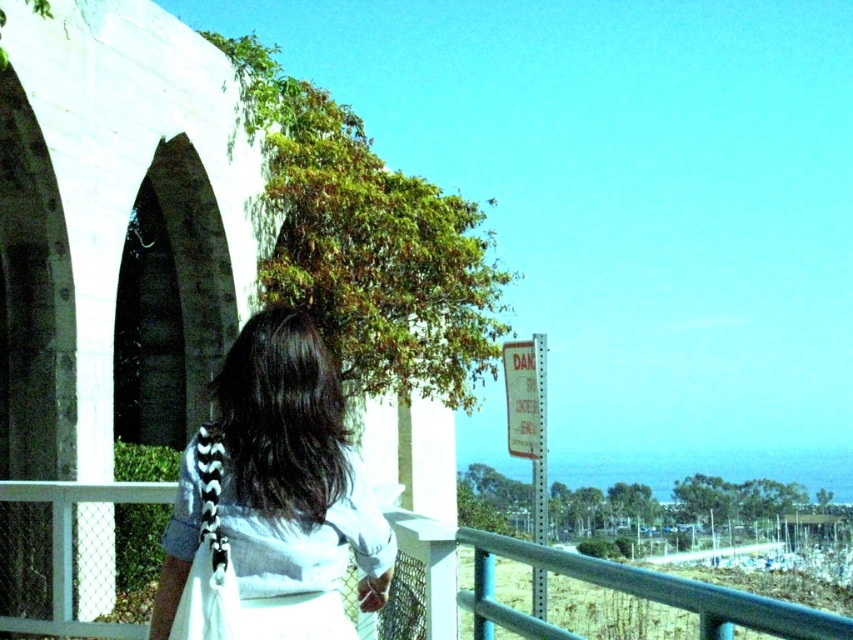
Is dark brown hair at center wider than smooth teal railing at center?

In fact, dark brown hair at center might be narrower than smooth teal railing at center.

Does dark brown hair at center have a lesser height compared to smooth teal railing at center?

Correct, dark brown hair at center is not as tall as smooth teal railing at center.

Which is in front, point (331, 518) or point (523, 636)?

Point (331, 518) is in front.

What are the coordinates of `dark brown hair at center` in the screenshot? It's located at (277, 477).